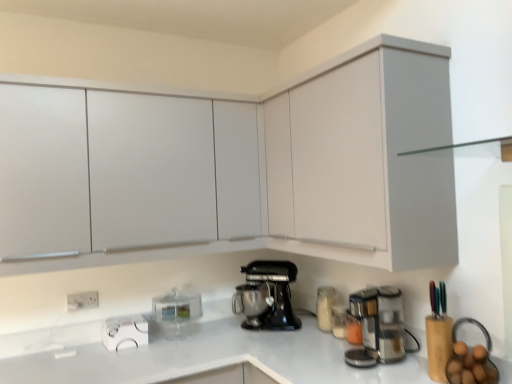
Question: Is transparent plastic container at center, which is the first kitchen appliance from left to right, next to white glossy kettle at lower left?

Choices:
 (A) no
 (B) yes

Answer: (A)

Question: Would you say transparent plastic container at center, positioned as the 2th kitchen appliance in right-to-left order, is outside white glossy kettle at lower left?

Choices:
 (A) no
 (B) yes

Answer: (B)

Question: Considering the relative sizes of transparent plastic container at center, which is the first kitchen appliance from left to right, and white glossy kettle at lower left in the image provided, is transparent plastic container at center, which is the first kitchen appliance from left to right, smaller than white glossy kettle at lower left?

Choices:
 (A) no
 (B) yes

Answer: (A)

Question: Considering the relative sizes of transparent plastic container at center, positioned as the 2th kitchen appliance in right-to-left order, and white glossy kettle at lower left in the image provided, is transparent plastic container at center, positioned as the 2th kitchen appliance in right-to-left order, wider than white glossy kettle at lower left?

Choices:
 (A) no
 (B) yes

Answer: (B)

Question: From a real-world perspective, is transparent plastic container at center, which is the first kitchen appliance from left to right, located beneath white glossy kettle at lower left?

Choices:
 (A) yes
 (B) no

Answer: (B)

Question: Is transparent plastic container at center, which is the first kitchen appliance from left to right, positioned far away from white glossy kettle at lower left?

Choices:
 (A) yes
 (B) no

Answer: (B)

Question: Is white matte cabinet at upper right, the second cabinetry when ordered from front to back, thinner than white matte cabinet at upper left, which is counted as the third cabinetry, starting from the front?

Choices:
 (A) no
 (B) yes

Answer: (B)

Question: From the image's perspective, is white matte cabinet at upper right, which is counted as the 2th cabinetry, starting from the back, on top of white matte cabinet at upper left, which is counted as the third cabinetry, starting from the front?

Choices:
 (A) yes
 (B) no

Answer: (A)

Question: Is white matte cabinet at upper right, the second cabinetry when ordered from front to back, smaller than white matte cabinet at upper left, the first cabinetry from the back?

Choices:
 (A) no
 (B) yes

Answer: (B)

Question: Is white matte cabinet at upper right, which is counted as the 2th cabinetry, starting from the back, completely or partially outside of white matte cabinet at upper left, the first cabinetry from the back?

Choices:
 (A) no
 (B) yes

Answer: (B)

Question: Can you confirm if white matte cabinet at upper right, the second cabinetry when ordered from front to back, is positioned to the right of white matte cabinet at upper left, which is counted as the third cabinetry, starting from the front?

Choices:
 (A) no
 (B) yes

Answer: (B)

Question: Is white matte cabinet at upper right, the second cabinetry when ordered from front to back, to the left of white matte cabinet at upper left, which is counted as the third cabinetry, starting from the front, from the viewer's perspective?

Choices:
 (A) no
 (B) yes

Answer: (A)

Question: Considering the relative sizes of matte white cabinet at upper center, which is the 3th cabinetry from back to front, and white plastic electric outlet at lower left in the image provided, is matte white cabinet at upper center, which is the 3th cabinetry from back to front, wider than white plastic electric outlet at lower left?

Choices:
 (A) no
 (B) yes

Answer: (B)